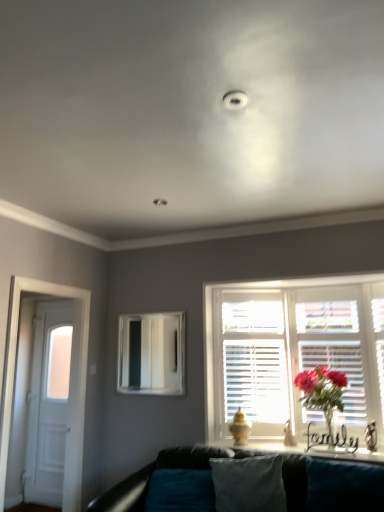
Question: Is point (119, 336) positioned closer to the camera than point (129, 489)?

Choices:
 (A) closer
 (B) farther

Answer: (B)

Question: Looking at their shapes, would you say metallic silver mirror at center is wider or thinner than teal fabric couch at lower center?

Choices:
 (A) thin
 (B) wide

Answer: (A)

Question: Considering the real-world distances, which object is closest to the velvety teal pillow at center?

Choices:
 (A) teal fabric couch at lower center
 (B) white wooden door at left
 (C) metallic silver mirror at center
 (D) white wooden shutters at center
 (E) matte pink flowers at window

Answer: (A)

Question: Which object is the farthest from the metallic silver mirror at center?

Choices:
 (A) teal fabric couch at lower center
 (B) velvety teal pillow at center
 (C) white wooden shutters at center
 (D) white wooden door at left
 (E) white glossy door at left

Answer: (B)